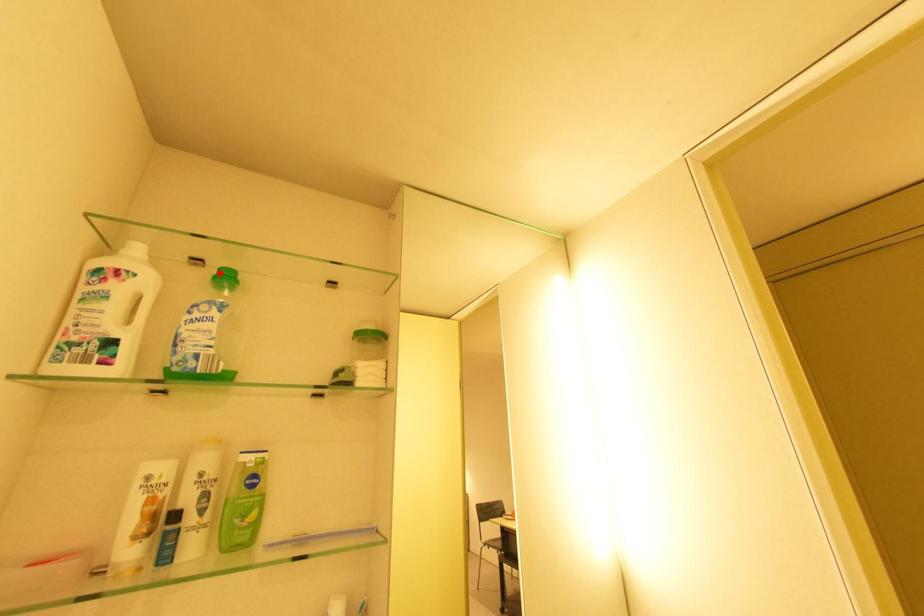
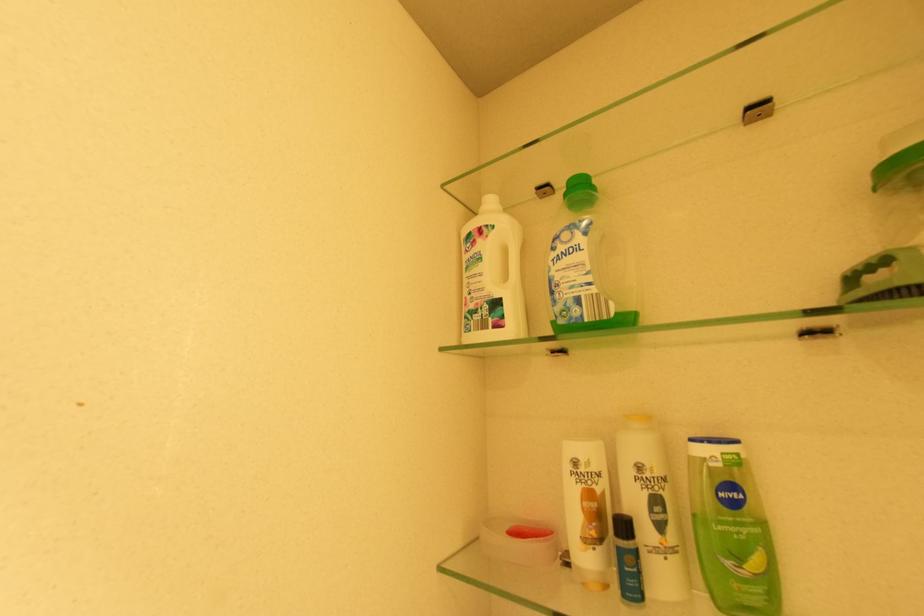
Where in the second image is the point corresponding to the highlighted location from the first image?

(569, 190)